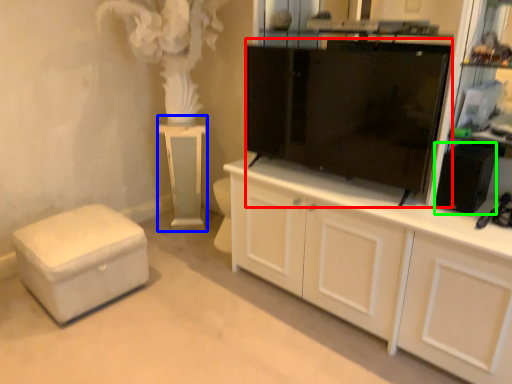
Question: Estimate the real-world distances between objects in this image. Which object is farther from tv cabinet (highlighted by a red box), table (highlighted by a blue box) or appliance (highlighted by a green box)?

Choices:
 (A) table
 (B) appliance

Answer: (A)